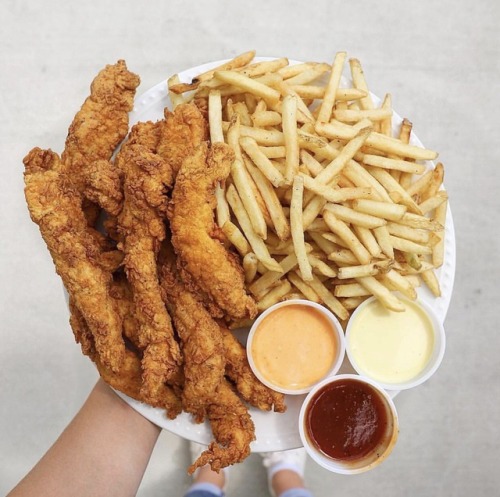
Image resolution: width=500 pixels, height=497 pixels. In order to click on light gray flooring in this screenshot , I will do `click(454, 418)`, `click(28, 414)`.